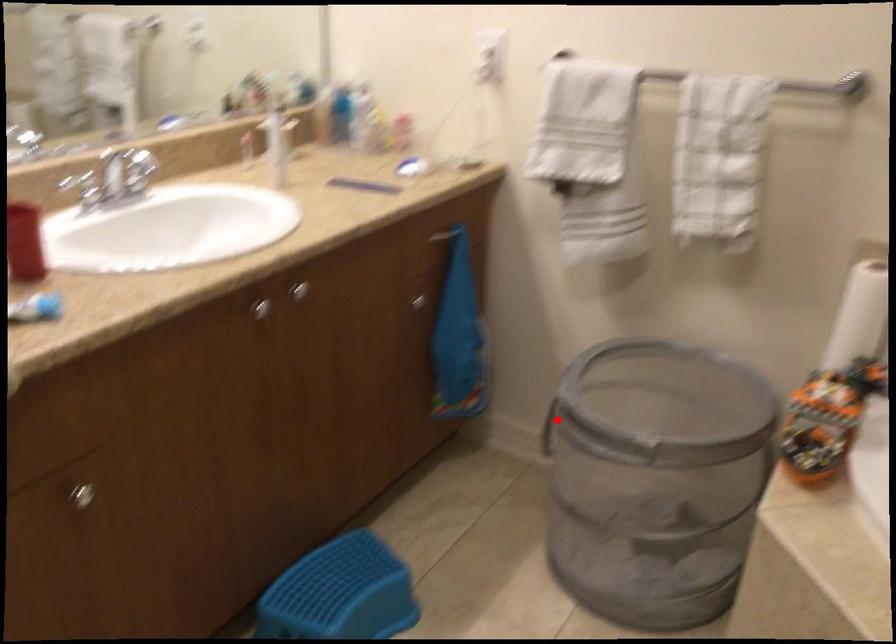
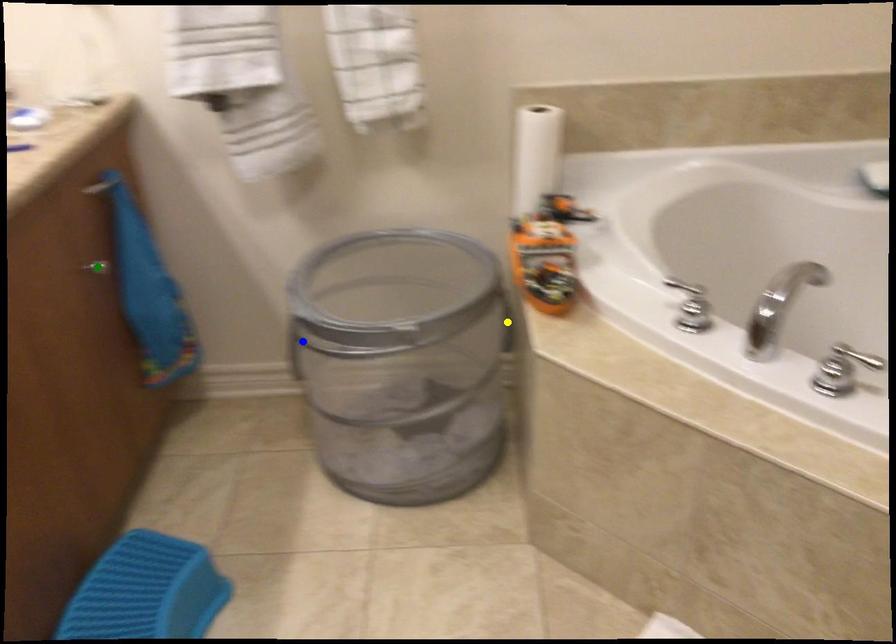
Question: I am providing you with two images of the same scene from different viewpoints. A red point is marked on the first image. You are given multiple points on the second image. Which point in image 2 represents the same 3d spot as the red point in image 1?

Choices:
 (A) yellow point
 (B) green point
 (C) blue point

Answer: (C)